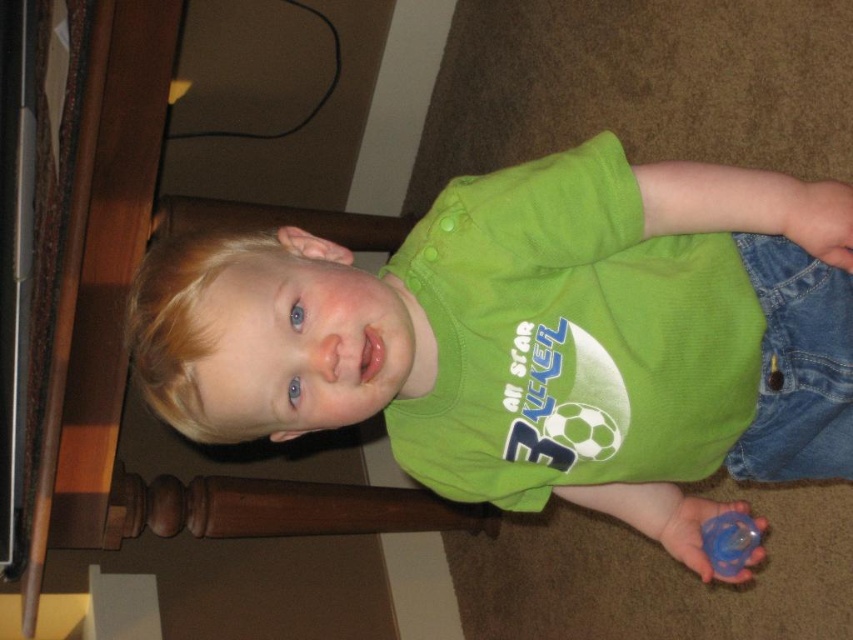
Question: Which of the following is the farthest from the observer?

Choices:
 (A) (735, 564)
 (B) (245, 339)

Answer: (A)

Question: Is green matte shirt at center above blue rubber pacifier at lower right?

Choices:
 (A) yes
 (B) no

Answer: (A)

Question: Is green matte shirt at center smaller than blue rubber pacifier at lower right?

Choices:
 (A) yes
 (B) no

Answer: (B)

Question: Is green matte shirt at center to the left of blue rubber pacifier at lower right from the viewer's perspective?

Choices:
 (A) yes
 (B) no

Answer: (A)